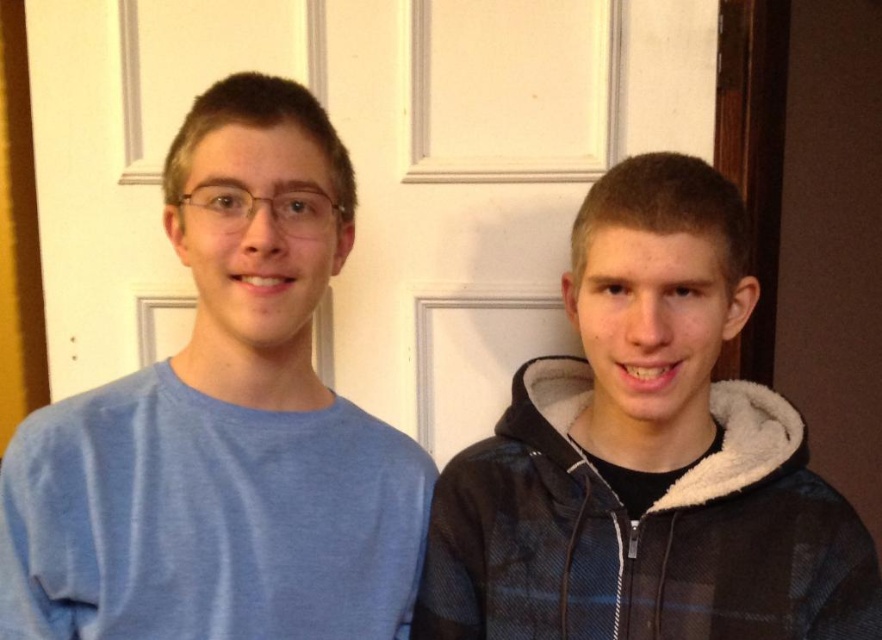
You are a painter who needs to paint the white matte door at center and the black fleece hoodie at center. Which object will require more paint due to its height?

The white matte door at center is taller than the black fleece hoodie at center, so it will require more paint.

You are standing in a room and want to touch the white matte door at center and the black fleece hoodie at center. Which object will you reach first?

You will reach the white matte door at center first because it is closer to you than the black fleece hoodie at center.

You are a painter who needs to hang a picture frame that is 1.5 meters tall on the wall. You observe the white matte door at center and the matte blue shirt at left in the scene. Which object can accommodate the frame vertically without exceeding its height?

The white matte door at center has a greater height compared to the matte blue shirt at left, so the white matte door at center can accommodate the 1.5 meters tall frame vertically without exceeding its height.